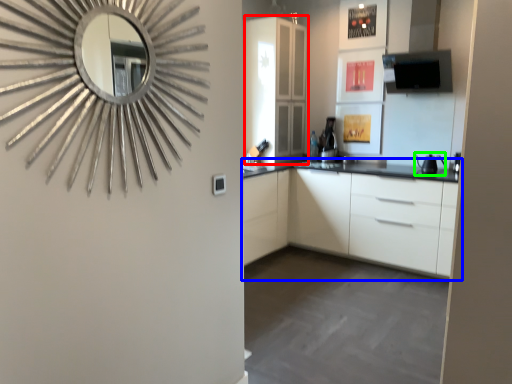
Question: Which object is the closest to the glass door (highlighted by a red box)? Choose among these: cabinetry (highlighted by a blue box) or appliance (highlighted by a green box).

Choices:
 (A) cabinetry
 (B) appliance

Answer: (A)